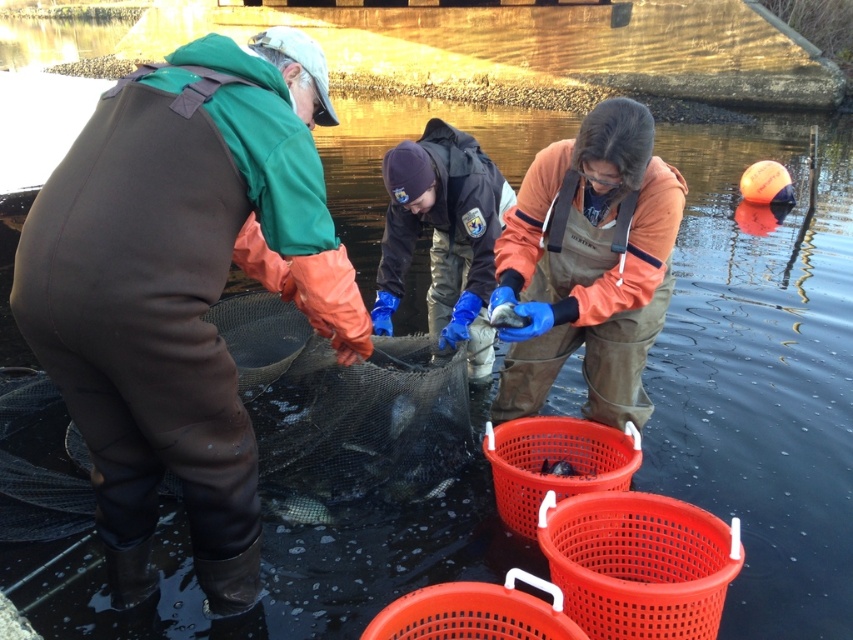
In the scene shown: You are a fisherman who needs to place a marker at the exact center of the water surface. The brown rubber net at center is located at coordinates point 0.633, 0.402. Is the net positioned to the left or right of the water surface center?

The brown rubber net at center is located at coordinates point (341, 404). Since the x coordinate is 0.633, which is greater than 0.5, the net is positioned to the right of the water surface center.

You are a fisherman who needs to choose between the shiny silver fish at center and the smooth gray fish at center to place in a basket that can only hold fish wider than 30 cm. Which fish should you choose?

The shiny silver fish at center has a larger width than the smooth gray fish at center, so you should choose the shiny silver fish at center since it is wider and likely meets the basket requirement.

You are a safety inspector observing the fish handling activity. You need to ensure that the brown waterproof overalls at left and the brown rubber net at center are properly positioned for safety. Based on their heights, which object is taller?

The brown waterproof overalls at left is taller than the brown rubber net at center according to the description.